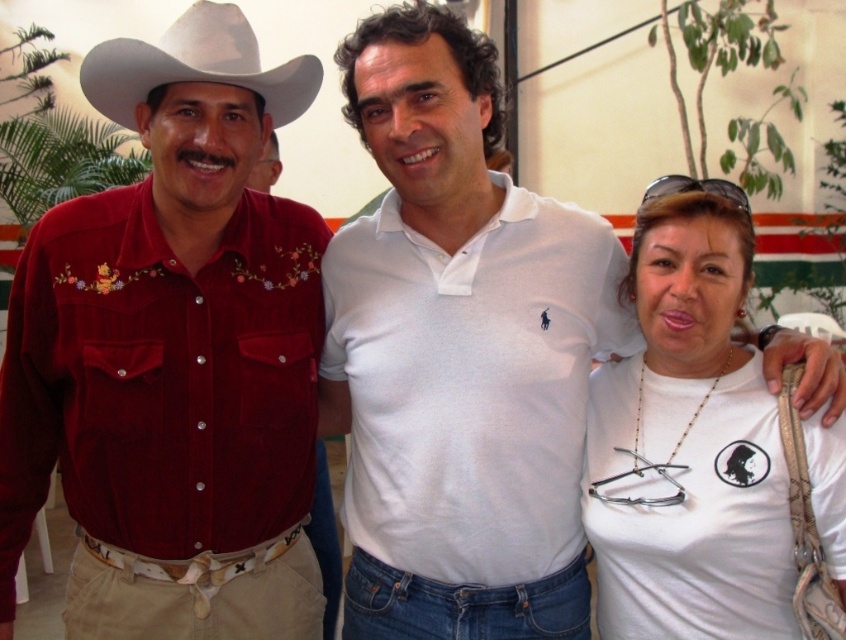
Question: Which of the following is the farthest from the observer?

Choices:
 (A) matte red shirt at left
 (B) white matte t-shirt at right

Answer: (A)

Question: Can you confirm if white felt cowboy hat at left is wider than matte red shirt at left?

Choices:
 (A) yes
 (B) no

Answer: (A)

Question: Can you confirm if white matte t-shirt at right is positioned to the right of matte red shirt at left?

Choices:
 (A) yes
 (B) no

Answer: (A)

Question: Observing the image, what is the correct spatial positioning of white felt cowboy hat at left in reference to matte red shirt at left?

Choices:
 (A) left
 (B) right

Answer: (B)

Question: Considering the real-world distances, which object is farthest from the white felt cowboy hat at left?

Choices:
 (A) matte red shirt at left
 (B) white matte t-shirt at right
 (C) velvet red shirt at center
 (D) white cotton polo shirt at center

Answer: (B)

Question: Which of the following is the farthest from the observer?

Choices:
 (A) white felt cowboy hat at left
 (B) velvet red shirt at center
 (C) white matte t-shirt at right

Answer: (C)